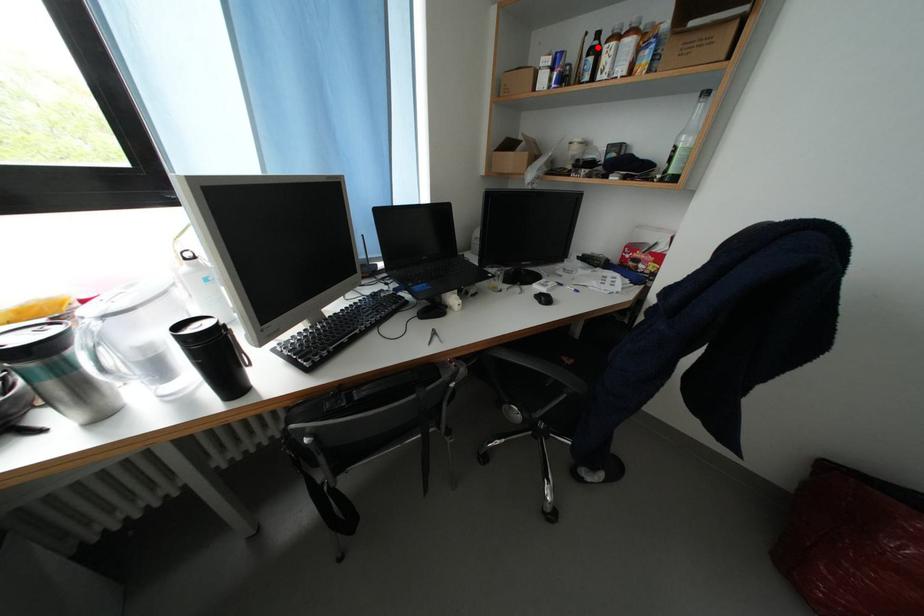
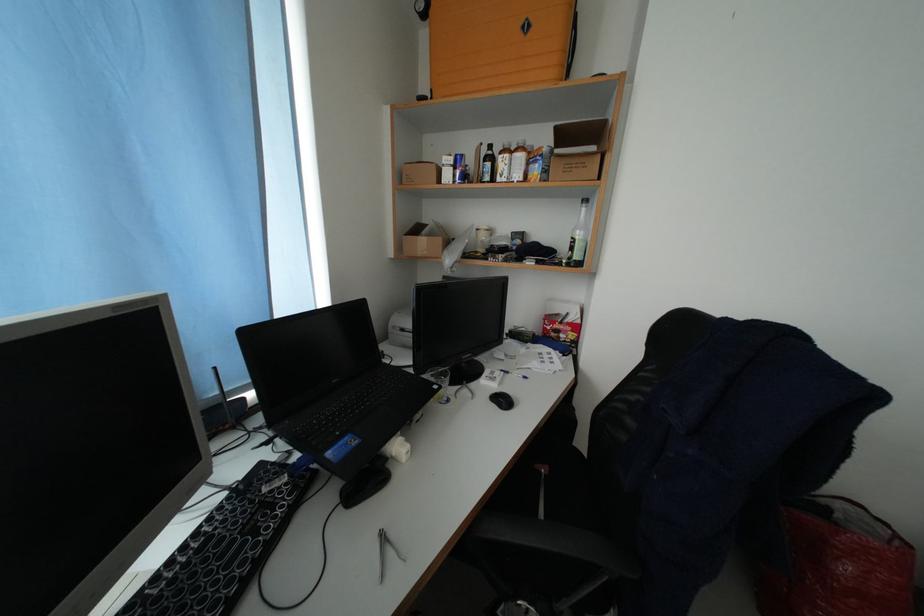
The point at the highlighted location is marked in the first image. Where is the corresponding point in the second image?

(492, 156)